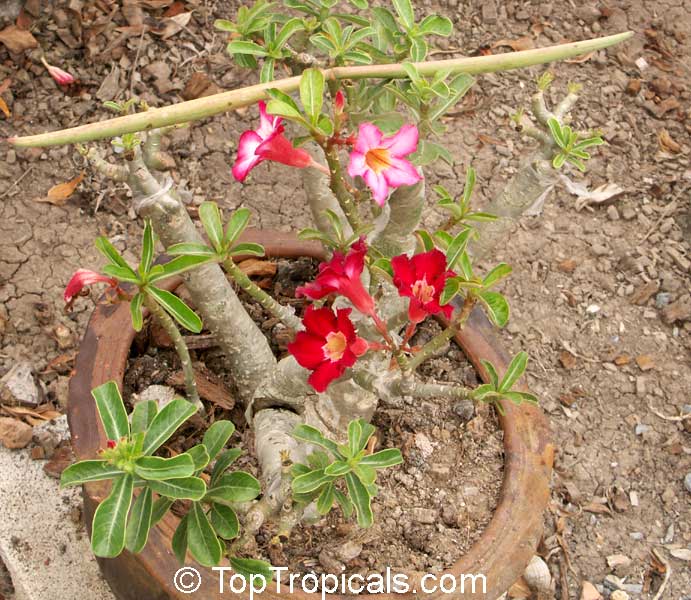
Where is `old pot`? The width and height of the screenshot is (691, 600). old pot is located at coordinates (524, 505).